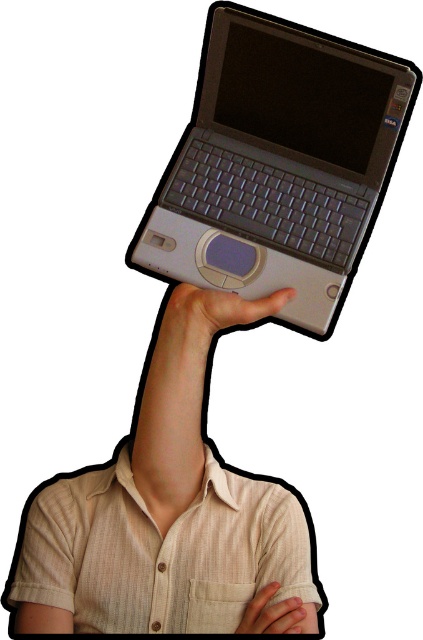
Question: Is satin silver laptop at upper center wider than matte gray laptop at upper center?

Choices:
 (A) yes
 (B) no

Answer: (A)

Question: Where is satin silver laptop at upper center located in relation to matte gray laptop at upper center in the image?

Choices:
 (A) below
 (B) above

Answer: (B)

Question: Considering the real-world distances, which object is closest to the matte gray laptop at upper center?

Choices:
 (A) matte gray hand at upper center
 (B) satin silver laptop at upper center

Answer: (B)

Question: Does satin silver laptop at upper center have a smaller size compared to matte gray hand at upper center?

Choices:
 (A) no
 (B) yes

Answer: (A)

Question: Based on their relative distances, which object is farther from the matte gray hand at upper center?

Choices:
 (A) matte gray laptop at upper center
 (B) satin silver laptop at upper center

Answer: (B)

Question: Which point appears closest to the camera in this image?

Choices:
 (A) (264, 632)
 (B) (263, 298)

Answer: (A)